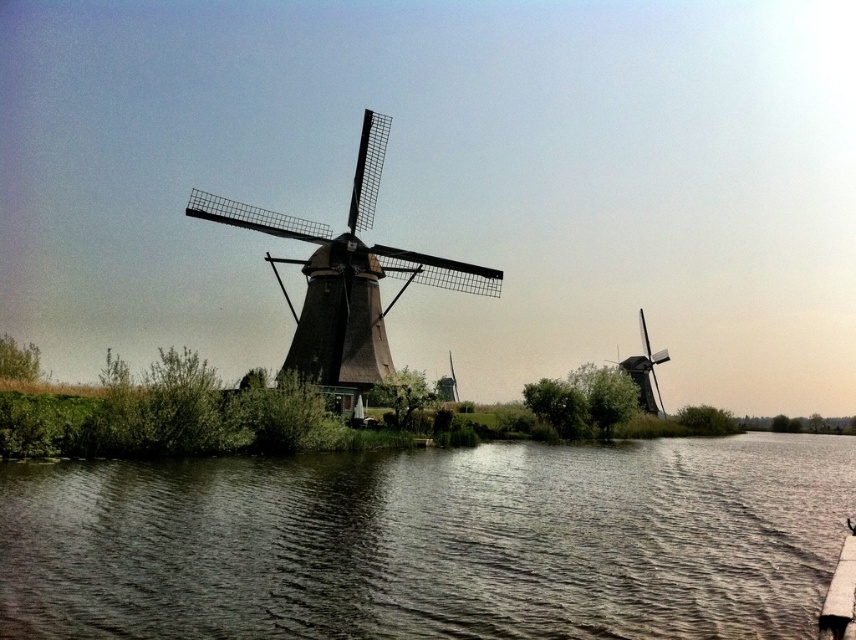
Question: Which object is farther from the camera taking this photo?

Choices:
 (A) dark water at center
 (B) brown thatched roof windmill at center

Answer: (B)

Question: Does dark water at center lie in front of brown thatched roof windmill at center?

Choices:
 (A) yes
 (B) no

Answer: (A)

Question: Does dark water at center appear on the right side of brown thatched roof windmill at center?

Choices:
 (A) no
 (B) yes

Answer: (B)

Question: Which of the following is the farthest from the observer?

Choices:
 (A) (311, 339)
 (B) (717, 637)

Answer: (A)

Question: Does dark water at center appear on the right side of brown thatched roof windmill at center?

Choices:
 (A) yes
 (B) no

Answer: (A)